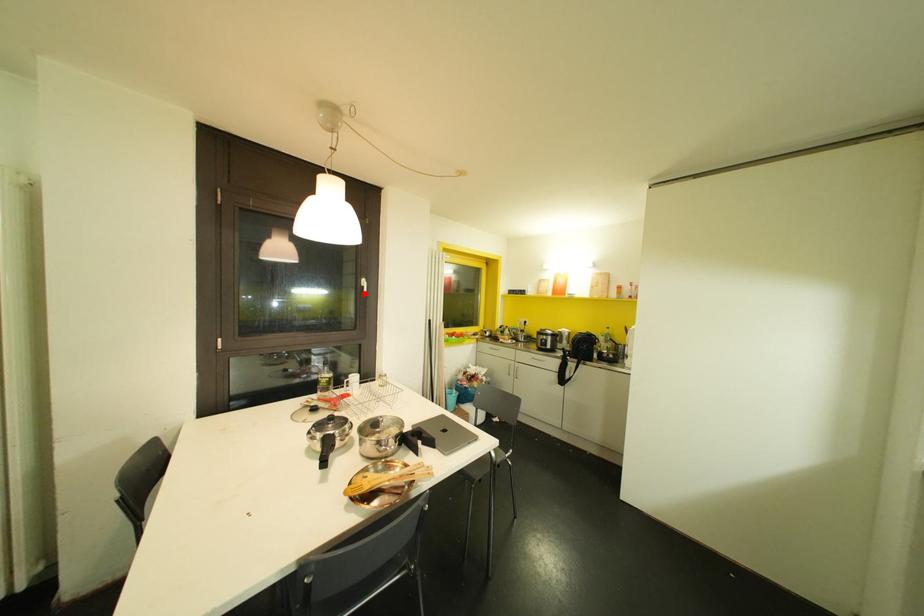
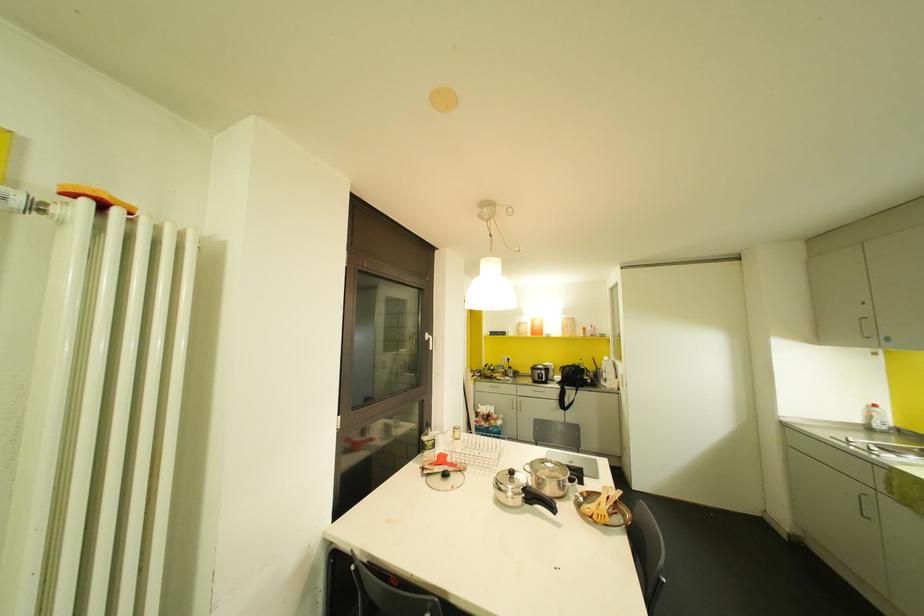
In the second image, find the point that corresponds to the highlighted location in the first image.

(430, 347)